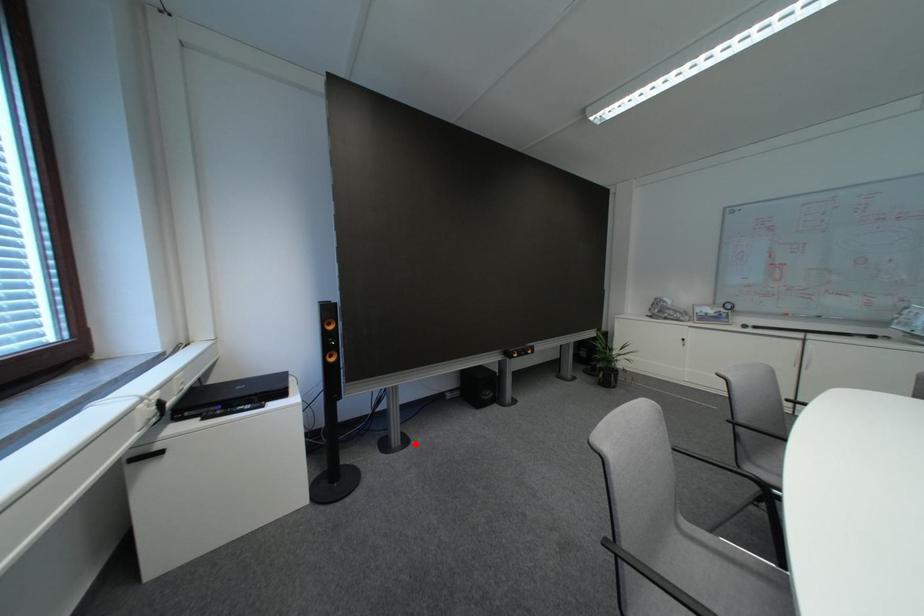
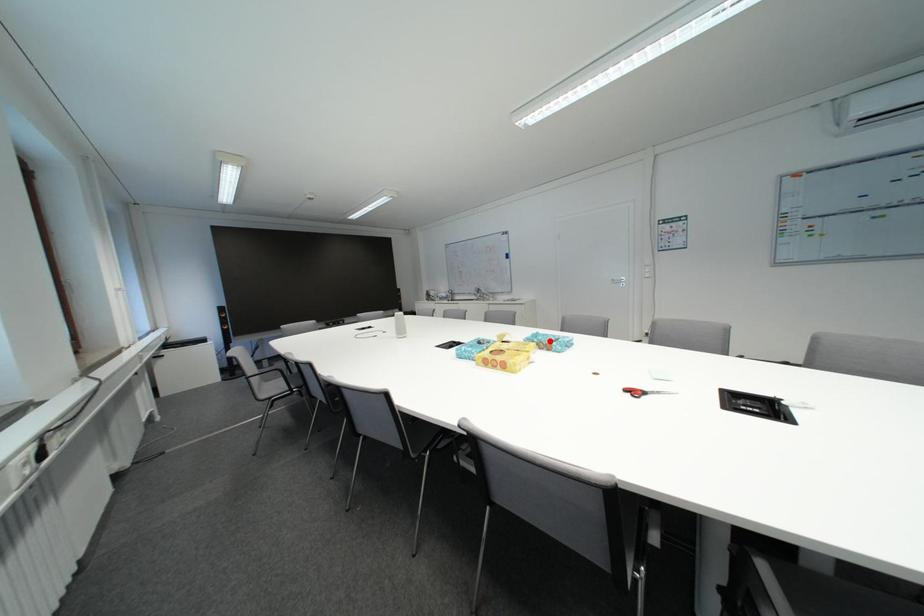
I am providing you with two images of the same scene from different viewpoints. A red point is marked on the first image and another point is marked on the second image. Is the marked point in image1 the same physical position as the marked point in image2?

No